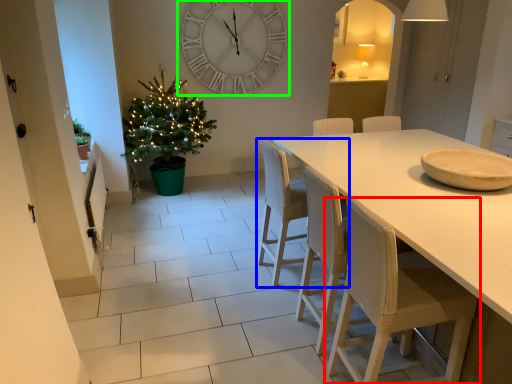
Question: Estimate the real-world distances between objects in this image. Which object is farther from chair (highlighted by a red box), chair (highlighted by a blue box) or wall clock (highlighted by a green box)?

Choices:
 (A) chair
 (B) wall clock

Answer: (B)